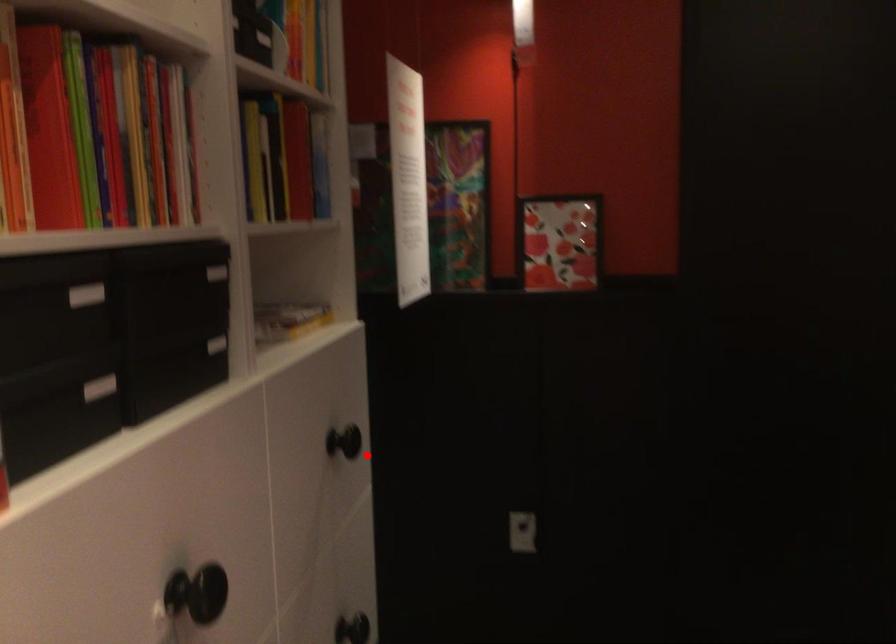
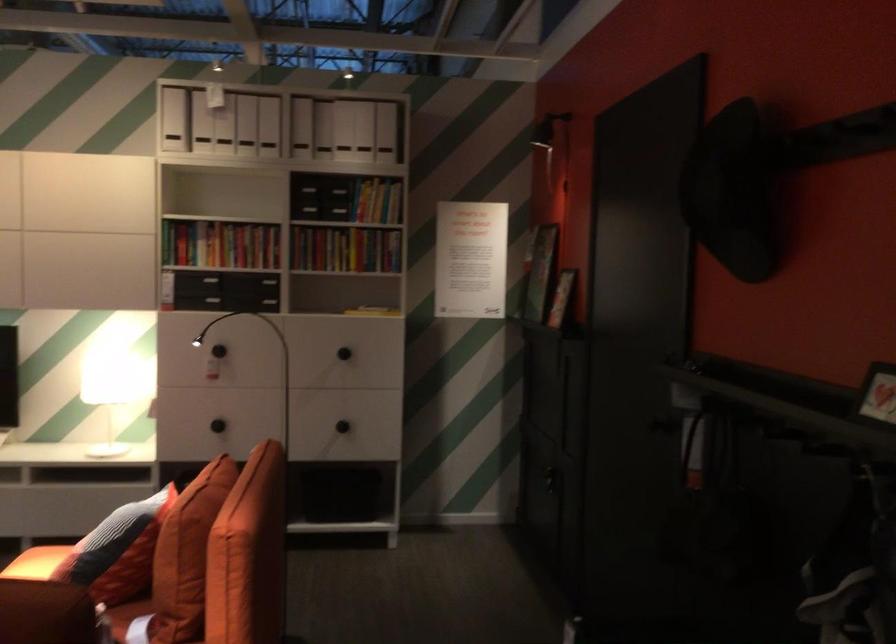
Question: A red point is marked in image1. In image2, is the corresponding 3D point closer to the camera or farther? Reply with the corresponding letter.

Choices:
 (A) The corresponding 3D point is closer.
 (B) The corresponding 3D point is farther.

Answer: (B)